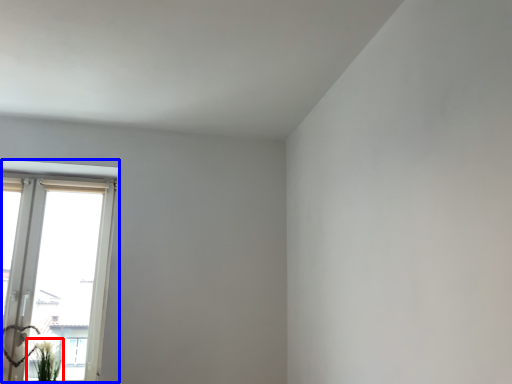
Question: Which object is further to the camera taking this photo, plant (highlighted by a red box) or window (highlighted by a blue box)?

Choices:
 (A) plant
 (B) window

Answer: (B)